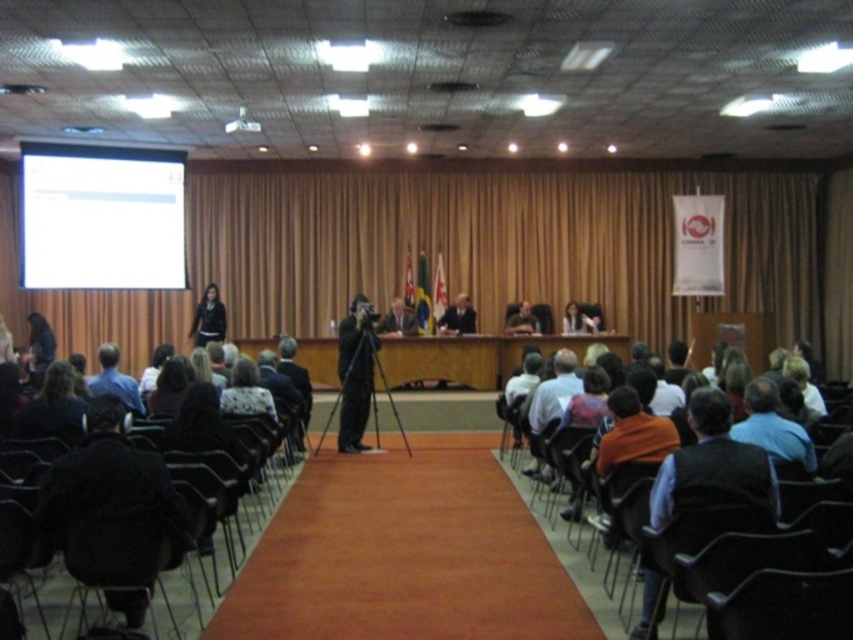
Question: Which of these objects is positioned farthest from the brown fabric curtain at center?

Choices:
 (A) white glossy projection screen at upper left
 (B) matte black suit at center

Answer: (A)

Question: Is orange shirt at center closer to camera compared to dark suit at center?

Choices:
 (A) no
 (B) yes

Answer: (B)

Question: Which point appears closest to the camera in this image?

Choices:
 (A) (695, 428)
 (B) (134, 189)

Answer: (A)

Question: Estimate the real-world distances between objects in this image. Which object is farther from the orange fabric shirt at lower right?

Choices:
 (A) black matte camera at center
 (B) white glossy projection screen at upper left
 (C) black fabric at left

Answer: (B)

Question: Does brown fabric curtain at center appear under matte black suit at center?

Choices:
 (A) yes
 (B) no

Answer: (B)

Question: Does black fabric at left come behind dark suit at center?

Choices:
 (A) yes
 (B) no

Answer: (B)